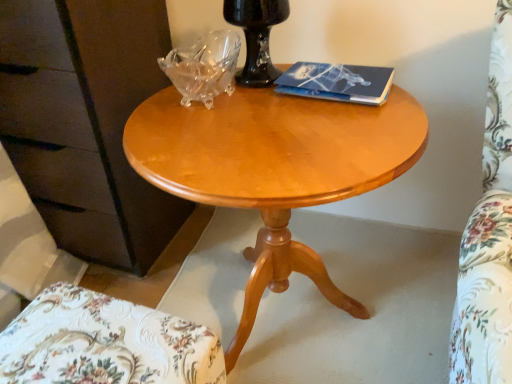
The width and height of the screenshot is (512, 384). What are the coordinates of `vacant space in front of black glass vase at upper center` in the screenshot? It's located at (278, 117).